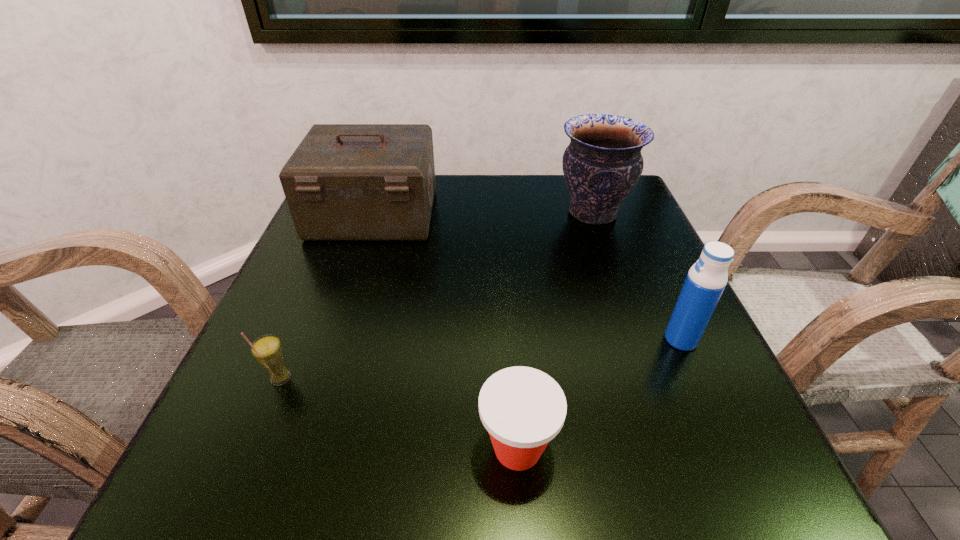
The height and width of the screenshot is (540, 960). Identify the location of vacant space that satisfies the following two spatial constraints: 1. on the front handle of the pottery; 2. on the left side of the third nearest object. (637, 339).

At what (x,y) coordinates should I click in order to perform the action: click on vacant space that satisfies the following two spatial constraints: 1. on the back side of the third farthest object; 2. on the right side of the third object from left to right. Please return your answer as a coordinate pair (x, y). The image size is (960, 540). Looking at the image, I should click on (510, 339).

Image resolution: width=960 pixels, height=540 pixels. What are the coordinates of `free region that satisfies the following two spatial constraints: 1. on the front handle of the pottery; 2. on the right side of the water bottle` in the screenshot? It's located at (637, 339).